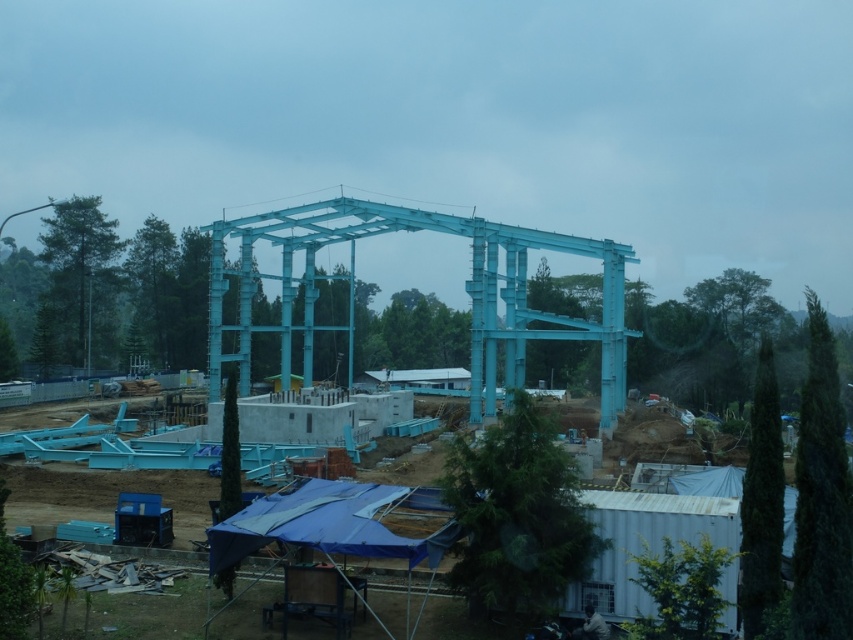
Question: Is metallic blue steel structure at center to the left of light blue metallic structure at center from the viewer's perspective?

Choices:
 (A) no
 (B) yes

Answer: (B)

Question: Does metallic blue steel structure at center come behind light blue metallic structure at center?

Choices:
 (A) no
 (B) yes

Answer: (A)

Question: Does metallic blue steel structure at center have a smaller size compared to light blue metallic structure at center?

Choices:
 (A) no
 (B) yes

Answer: (A)